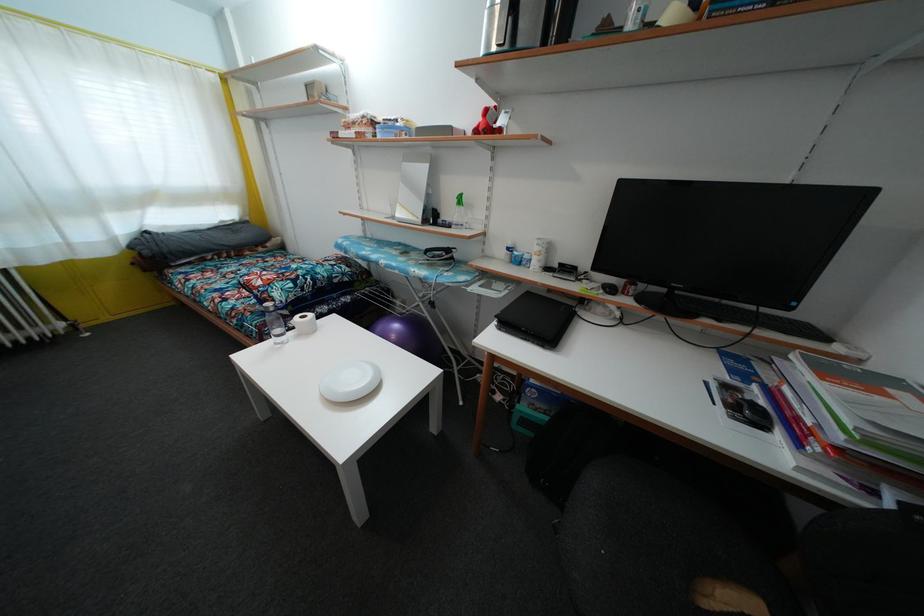
At what (x,y) coordinates should I click in order to perform the action: click on white plate. Please return your answer as a coordinate pair (x, y). Looking at the image, I should click on (349, 381).